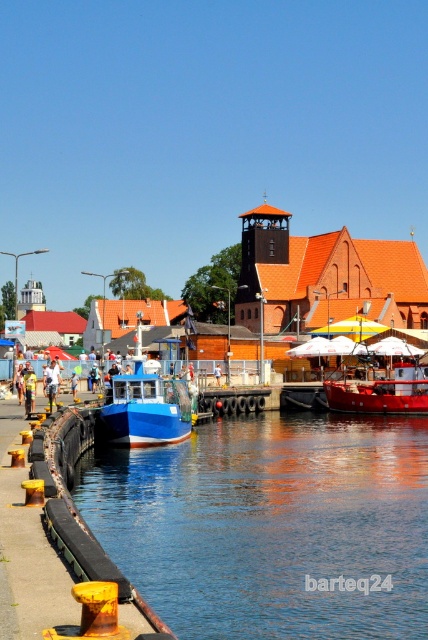
Who is positioned more to the right, blue fabric umbrella at center or yellow reflective vest at center?

Positioned to the right is blue fabric umbrella at center.

The width and height of the screenshot is (428, 640). I want to click on blue fabric umbrella at center, so click(x=51, y=381).

Describe the element at coordinates (51, 381) in the screenshot. I see `blue fabric umbrella at center` at that location.

Where is `blue fabric umbrella at center`? This screenshot has height=640, width=428. blue fabric umbrella at center is located at coordinates (51, 381).

How far apart are blue matte boat at center and yellow reflective vest at center?

blue matte boat at center is 10.37 meters from yellow reflective vest at center.

Between blue matte boat at center and yellow reflective vest at center, which one appears on the right side from the viewer's perspective?

From the viewer's perspective, blue matte boat at center appears more on the right side.

Is point (137, 336) positioned in front of point (32, 376)?

No, it is behind (32, 376).

Locate an element on the screen. This screenshot has height=640, width=428. blue matte boat at center is located at coordinates (143, 404).

Is blue matte boat at center above red matte boat at center?

Indeed, blue matte boat at center is positioned over red matte boat at center.

I want to click on blue matte boat at center, so click(143, 404).

The height and width of the screenshot is (640, 428). I want to click on blue matte boat at center, so click(143, 404).